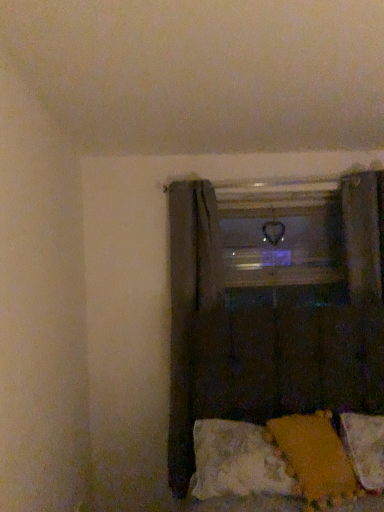
Question: Does dark fabric curtain at center, which ranks as the first curtain in back-to-front order, have a lesser width compared to transparent glass window frame at center?

Choices:
 (A) no
 (B) yes

Answer: (A)

Question: From the image's perspective, is dark fabric curtain at center, which ranks as the first curtain in back-to-front order, on top of transparent glass window frame at center?

Choices:
 (A) no
 (B) yes

Answer: (A)

Question: Is dark fabric curtain at center, which is the second curtain in front-to-back order, taller than transparent glass window frame at center?

Choices:
 (A) yes
 (B) no

Answer: (A)

Question: Would you say dark fabric curtain at center, which ranks as the first curtain in back-to-front order, is outside transparent glass window frame at center?

Choices:
 (A) no
 (B) yes

Answer: (B)

Question: Does dark fabric curtain at center, which ranks as the first curtain in back-to-front order, come behind transparent glass window frame at center?

Choices:
 (A) yes
 (B) no

Answer: (B)

Question: Relative to velvety orange pillow at lower right, acting as the 2th pillow starting from the right, is transparent glass window frame at center in front or behind?

Choices:
 (A) front
 (B) behind

Answer: (B)

Question: Considering the positions of transparent glass window frame at center and velvety orange pillow at lower right, positioned as the first pillow in left-to-right order, in the image, is transparent glass window frame at center taller or shorter than velvety orange pillow at lower right, positioned as the first pillow in left-to-right order,?

Choices:
 (A) tall
 (B) short

Answer: (A)

Question: From the image's perspective, relative to velvety orange pillow at lower right, positioned as the first pillow in left-to-right order, is transparent glass window frame at center above or below?

Choices:
 (A) below
 (B) above

Answer: (B)

Question: Would you say transparent glass window frame at center is to the left or to the right of velvety orange pillow at lower right, acting as the 2th pillow starting from the right, in the picture?

Choices:
 (A) right
 (B) left

Answer: (A)

Question: Is transparent glass window frame at center taller or shorter than dark fabric curtain at lower right, which is counted as the first curtain, starting from the front?

Choices:
 (A) tall
 (B) short

Answer: (B)

Question: Which is correct: transparent glass window frame at center is inside dark fabric curtain at lower right, the 2th curtain when ordered from back to front, or outside of it?

Choices:
 (A) outside
 (B) inside

Answer: (A)

Question: In the image, is transparent glass window frame at center on the left side or the right side of dark fabric curtain at lower right, the 2th curtain when ordered from back to front?

Choices:
 (A) right
 (B) left

Answer: (A)

Question: Is transparent glass window frame at center wider or thinner than dark fabric curtain at lower right, which is counted as the first curtain, starting from the front?

Choices:
 (A) wide
 (B) thin

Answer: (B)

Question: From a real-world perspective, relative to transparent glass window frame at center, is dark fabric curtain at lower right, which is counted as the first curtain, starting from the front, vertically above or below?

Choices:
 (A) above
 (B) below

Answer: (B)

Question: In the image, is dark fabric curtain at lower right, the 2th curtain when ordered from back to front, positioned in front of or behind transparent glass window frame at center?

Choices:
 (A) front
 (B) behind

Answer: (A)